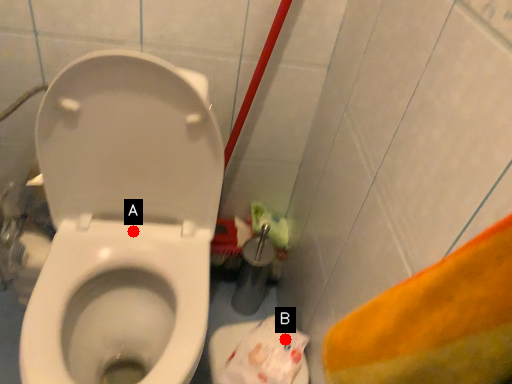
Question: Two points are circled on the image, labeled by A and B beside each circle. Among these points, which one is farthest from the camera?

Choices:
 (A) A is further
 (B) B is further

Answer: (B)